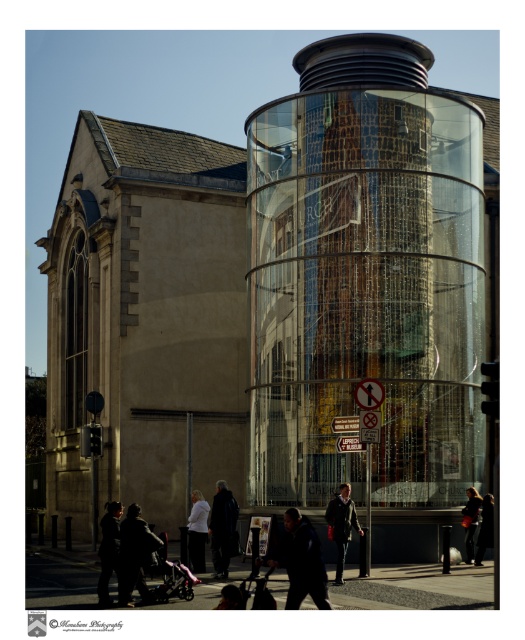
Question: Estimate the real-world distances between objects in this image. Which object is closer to the beige stone church at center?

Choices:
 (A) dark blue jacket at lower right
 (B) dark gray jacket at lower center

Answer: (A)

Question: Does dark brown leather jacket at lower right appear under dark blue jacket at lower right?

Choices:
 (A) yes
 (B) no

Answer: (B)

Question: Is dark blue jacket at lower right smaller than dark gray jacket at lower center?

Choices:
 (A) no
 (B) yes

Answer: (B)

Question: Which of the following is the closest to the observer?

Choices:
 (A) white cotton shirt at lower center
 (B) beige stone church at center
 (C) dark gray fabric jacket at lower left

Answer: (C)

Question: Can you confirm if dark gray jacket at lower left is positioned to the left of green fabric coat at center?

Choices:
 (A) no
 (B) yes

Answer: (B)

Question: Which object is the closest to the beige stone church at center?

Choices:
 (A) dark brown leather jacket at lower right
 (B) dark blue jacket at lower right

Answer: (A)